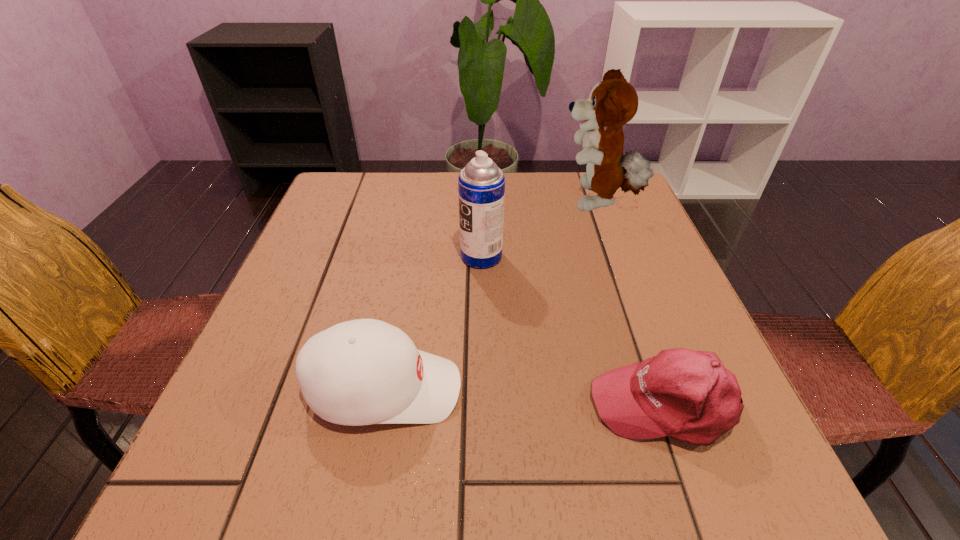
Find the location of a particular element. This screenshot has height=540, width=960. free spot located on the face of the puppy is located at coordinates (419, 202).

This screenshot has width=960, height=540. I want to click on free region located on the label side of the aerosol can, so click(429, 256).

The width and height of the screenshot is (960, 540). In order to click on vacant position located on the label side of the aerosol can in this screenshot , I will do `click(299, 256)`.

Locate an element on the screen. The width and height of the screenshot is (960, 540). vacant space situated on the label side of the aerosol can is located at coordinates (303, 256).

Find the location of a particular element. vacant space situated 0.340m on the front-facing side of the taller baseball cap is located at coordinates (668, 389).

Find the location of a particular element. This screenshot has width=960, height=540. vacant space located at the front of the shorter baseball cap with the brim is located at coordinates (341, 404).

You are a GUI agent. You are given a task and a screenshot of the screen. Output one action in this format:
    pyautogui.click(x=<x>, y=<y>)
    Task: Click on the vacant space located 0.310m at the front of the shorter baseball cap with the brim
    
    Given the screenshot: What is the action you would take?
    pyautogui.click(x=396, y=404)

I want to click on vacant region located 0.330m at the front of the shorter baseball cap with the brim, so click(x=384, y=404).

You are a GUI agent. You are given a task and a screenshot of the screen. Output one action in this format:
    pyautogui.click(x=<x>, y=<y>)
    Task: Click on the object that is at the far edge
    
    Given the screenshot: What is the action you would take?
    pyautogui.click(x=613, y=102)

Find the location of a particular element. This screenshot has height=540, width=960. object situated at the near edge is located at coordinates (688, 395).